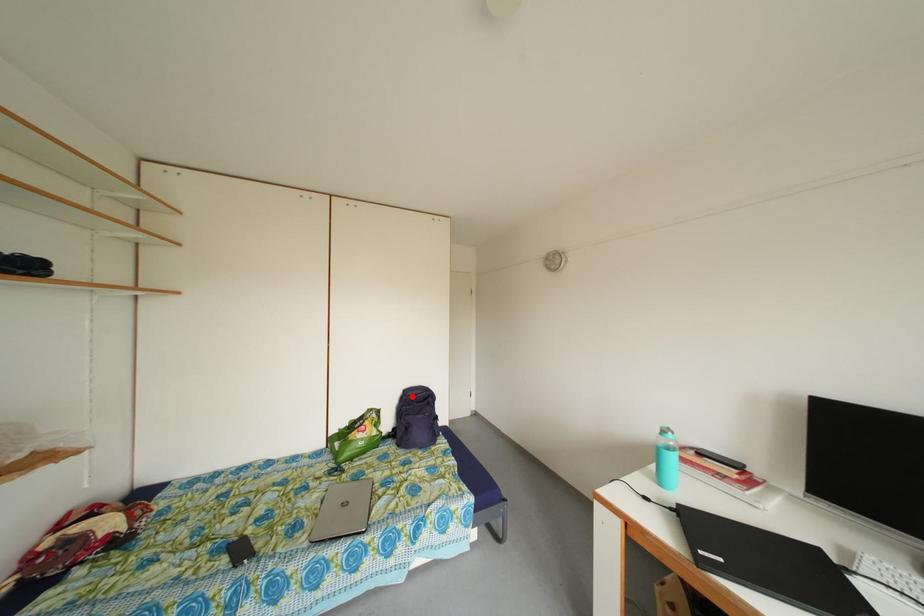
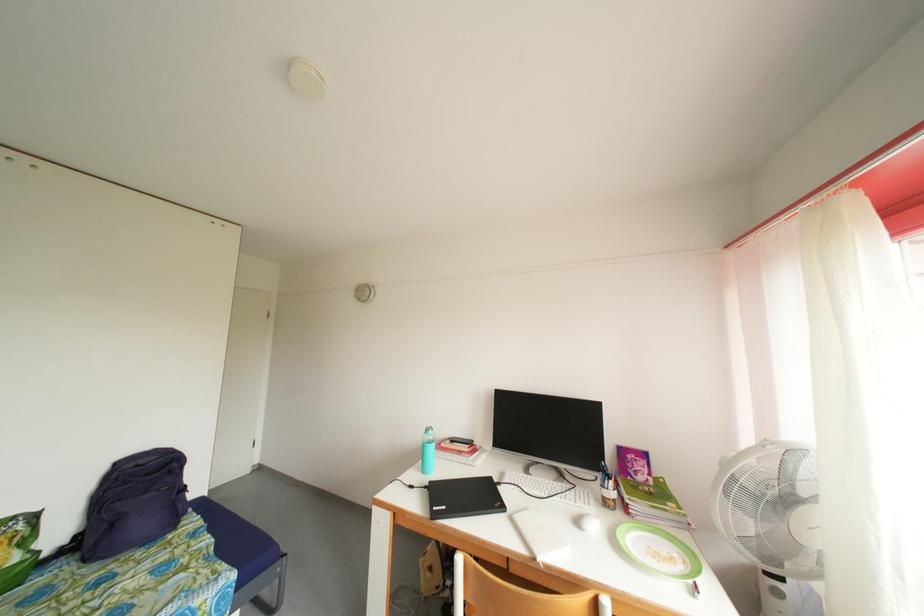
Find the pixel in the second image that matches the highlighted location in the first image.

(124, 469)